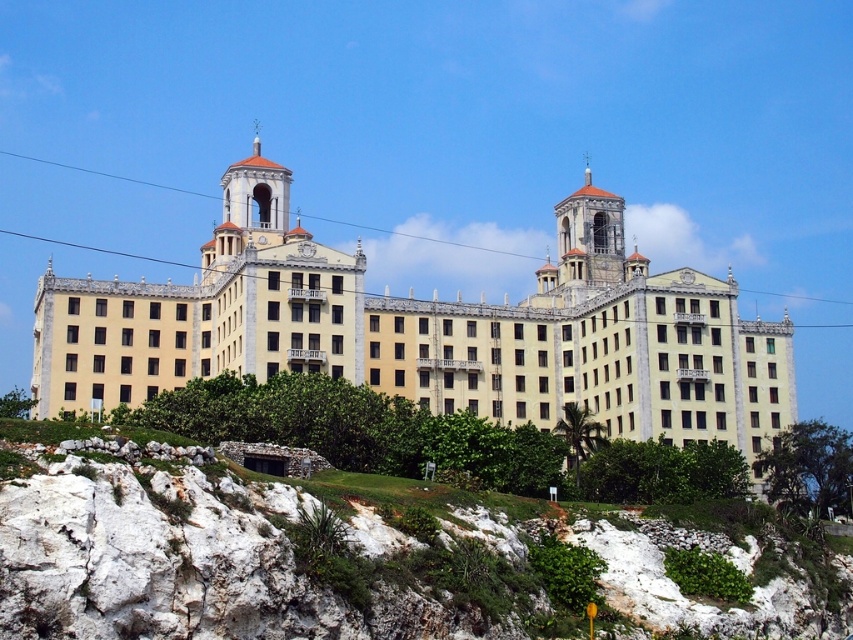
Question: Among these points, which one is nearest to the camera?

Choices:
 (A) (337, 307)
 (B) (622, 250)

Answer: (A)

Question: Can you confirm if smooth stone tower at upper center is thinner than smooth beige dome at center?

Choices:
 (A) yes
 (B) no

Answer: (A)

Question: Can you confirm if beige stone building at center is positioned to the left of smooth stone tower at upper center?

Choices:
 (A) yes
 (B) no

Answer: (A)

Question: Which point is farther to the camera?

Choices:
 (A) beige stone building at center
 (B) smooth beige dome at center

Answer: (B)

Question: Which of the following is the closest to the observer?

Choices:
 (A) (641, 289)
 (B) (556, 218)

Answer: (A)

Question: Can you confirm if beige stone building at center is positioned to the left of smooth stone tower at upper center?

Choices:
 (A) no
 (B) yes

Answer: (B)